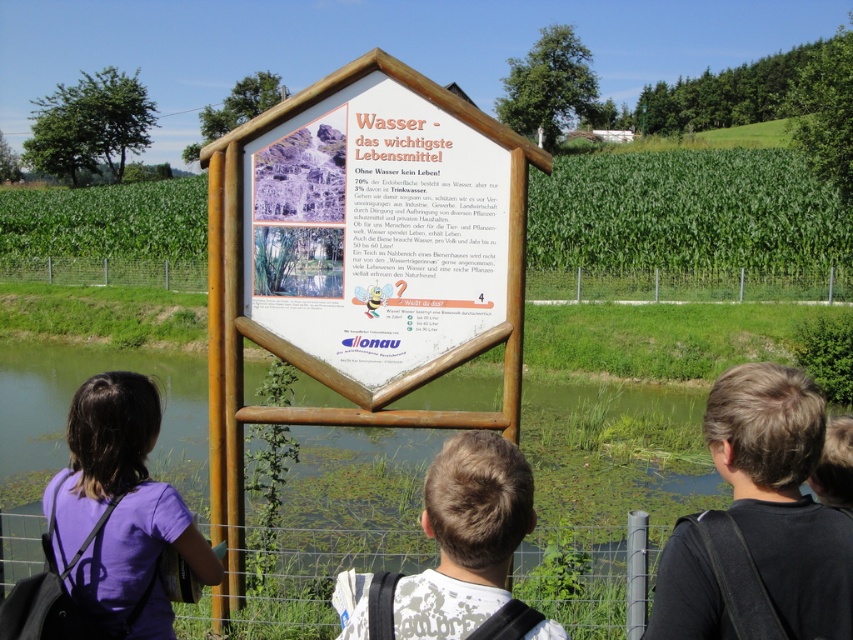
Does green grassy pond at center lie in front of wire mesh fence at lower center?

Yes, green grassy pond at center is in front of wire mesh fence at lower center.

Who is more forward, (20, 380) or (25, 529)?

Point (25, 529) is in front.

Does point (647, 472) lie in front of point (630, 588)?

No, it is not.

At what (x,y) coordinates should I click in order to perform the action: click on green grassy pond at center. Please return your answer as a coordinate pair (x, y). Looking at the image, I should click on (614, 461).

Can you confirm if brown hair at center is bigger than wire mesh fence at lower center?

Correct, brown hair at center is larger in size than wire mesh fence at lower center.

Who is more distant from viewer, (840, 593) or (32, 516)?

Positioned behind is point (32, 516).

This screenshot has width=853, height=640. Find the location of `brown hair at center`. brown hair at center is located at coordinates (759, 524).

Between green grass at center and wooden fence at center, which one has more height?

With more height is green grass at center.

In order to click on green grass at center in this screenshot , I will do `click(689, 224)`.

I want to click on green grass at center, so click(x=689, y=224).